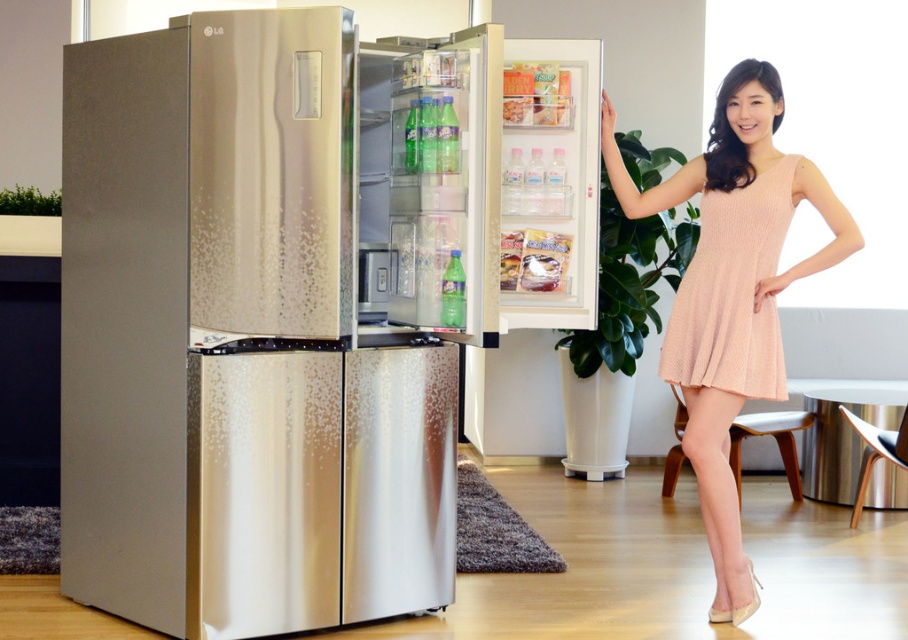
Based on the photo, is brushed metal refrigerator at center thinner than pink knit dress at center?

In fact, brushed metal refrigerator at center might be wider than pink knit dress at center.

Is brushed metal refrigerator at center further to the viewer compared to pink knit dress at center?

No.

Is point (194, 444) positioned behind point (749, 147)?

No, it is not.

This screenshot has height=640, width=908. Find the location of `brushed metal refrigerator at center`. brushed metal refrigerator at center is located at coordinates (253, 332).

Can you confirm if brushed metal refrigerator at center is positioned above peach textured dress at right?

No.

Can you confirm if brushed metal refrigerator at center is smaller than peach textured dress at right?

No.

Is point (163, 198) in front of point (746, 237)?

Yes.

Where is `brushed metal refrigerator at center`? This screenshot has width=908, height=640. brushed metal refrigerator at center is located at coordinates (253, 332).

Can you confirm if pink knit dress at center is smaller than peach textured dress at right?

Incorrect, pink knit dress at center is not smaller in size than peach textured dress at right.

Who is taller, pink knit dress at center or peach textured dress at right?

Standing taller between the two is pink knit dress at center.

Locate an element on the screen. pink knit dress at center is located at coordinates (732, 291).